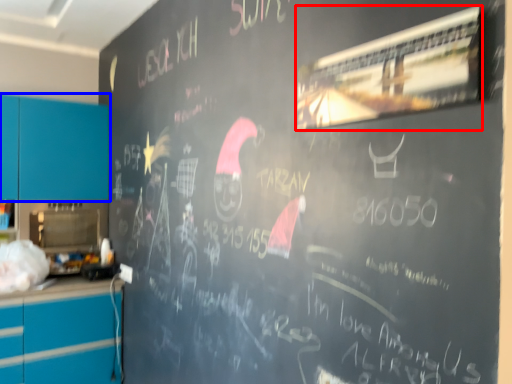
Question: Which point is closer to the camera, bulletin board (highlighted by a red box) or cabinetry (highlighted by a blue box)?

Choices:
 (A) bulletin board
 (B) cabinetry

Answer: (A)